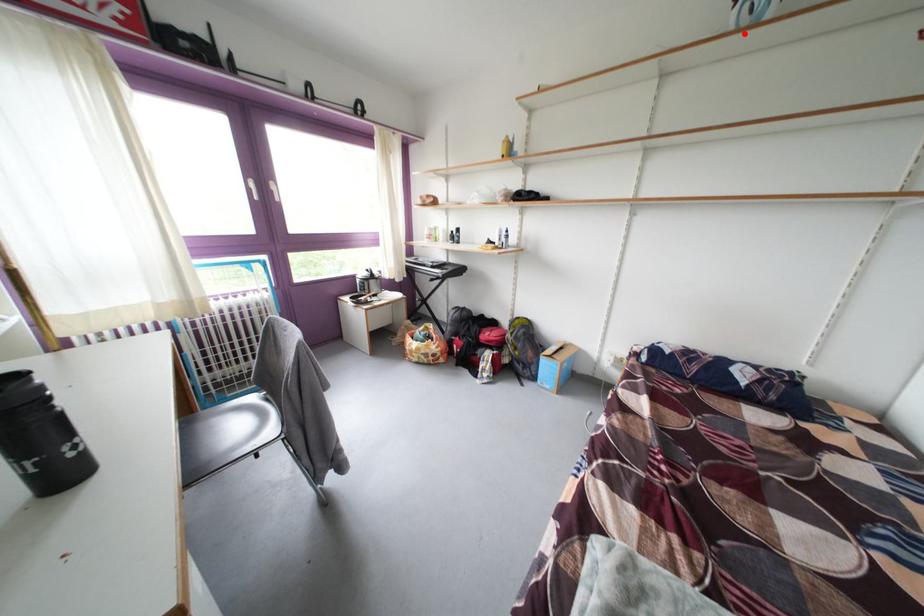
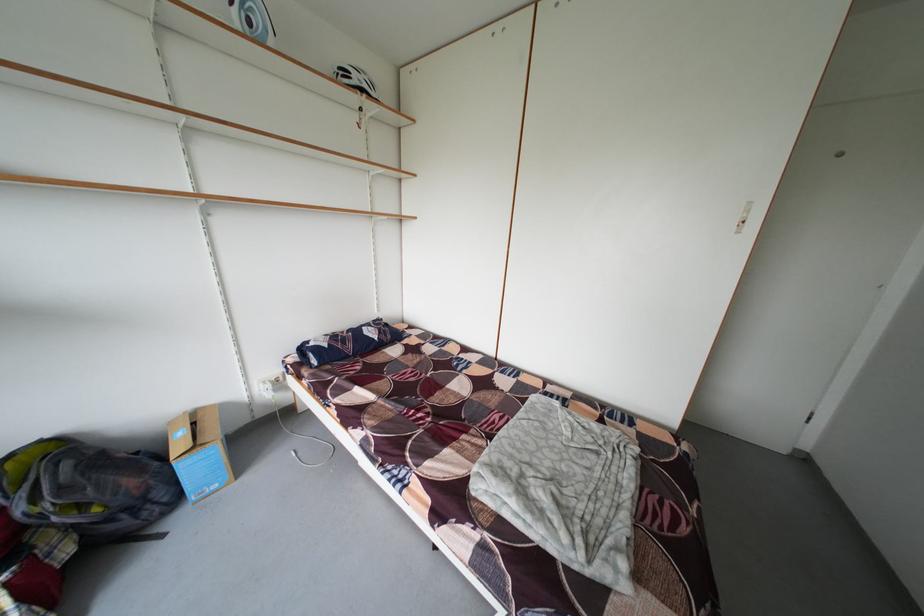
In the second image, find the point that corresponds to the highlighted location in the first image.

(249, 34)